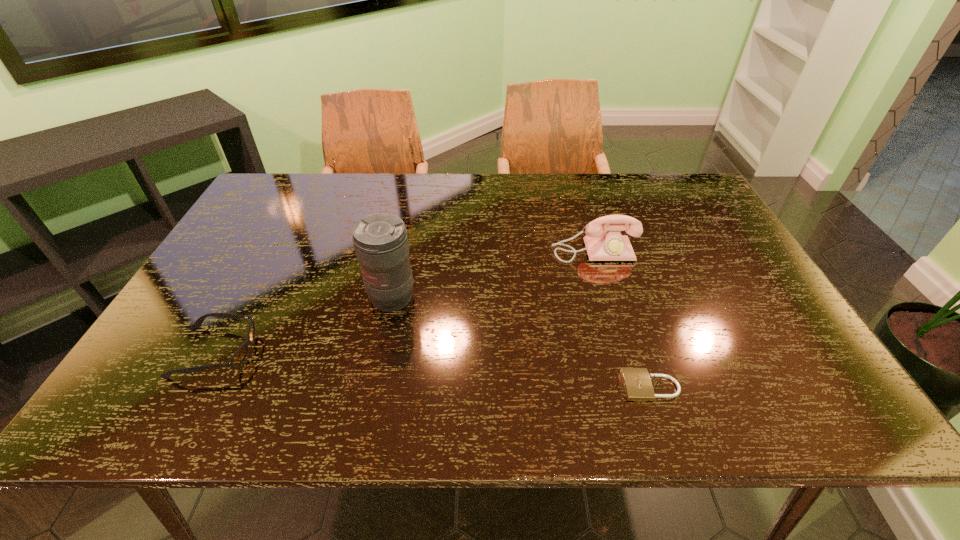
Locate an element on the screen. free space that satisfies the following two spatial constraints: 1. on the side of the telephoto lens where the control switches are located; 2. on the front-facing side of the leftmost object is located at coordinates (381, 352).